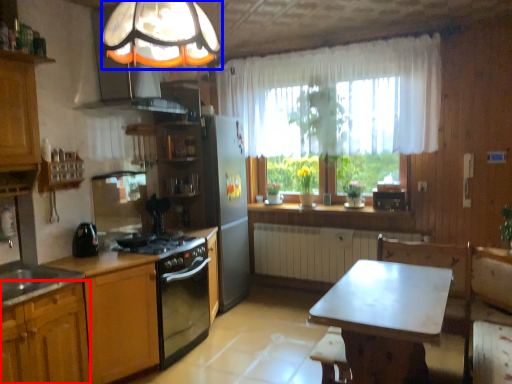
Question: Which object is further to the camera taking this photo, cabinetry (highlighted by a red box) or fixture (highlighted by a blue box)?

Choices:
 (A) cabinetry
 (B) fixture

Answer: (A)